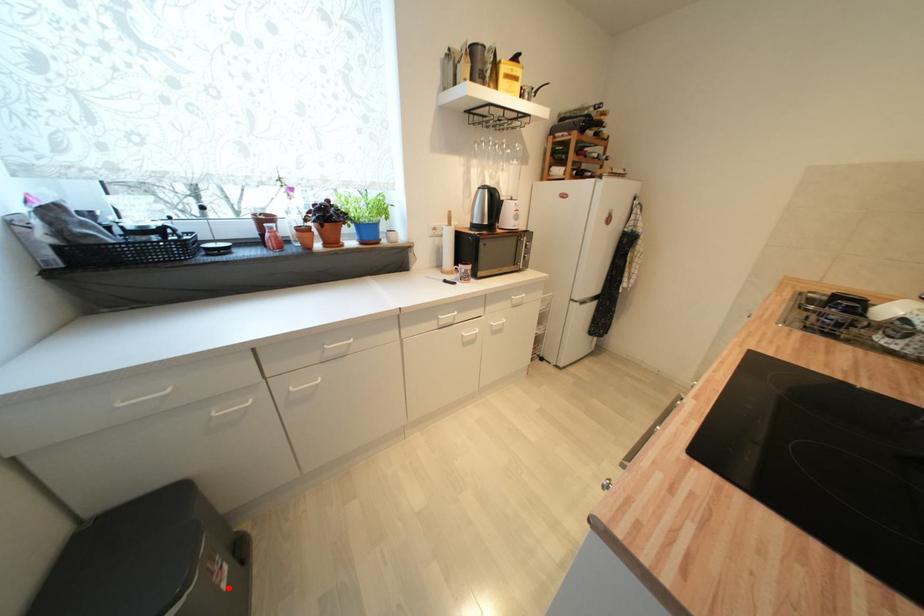
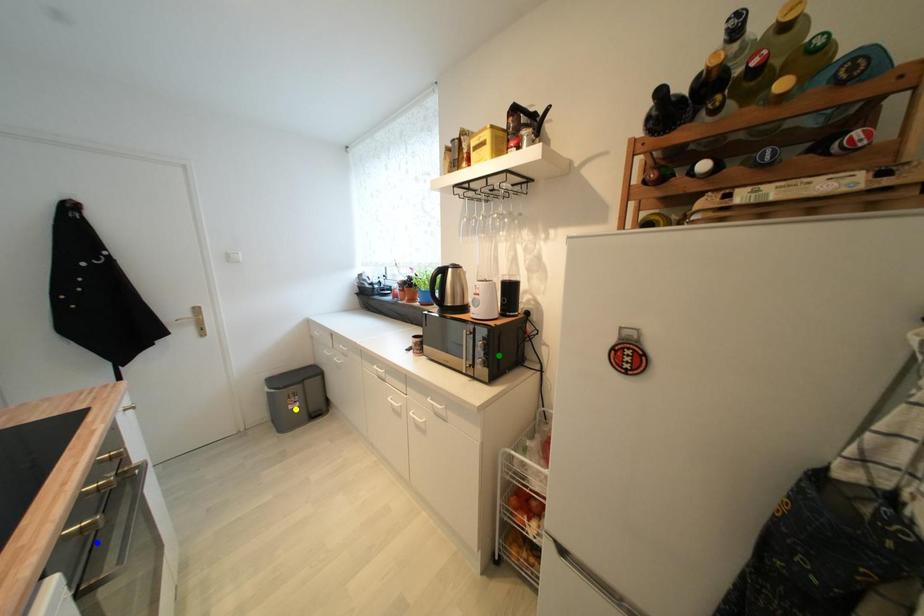
Question: I am providing you with two images of the same scene from different viewpoints. A red point is marked on the first image. You are given multiple points on the second image. Can you choose the point in image 2 that corresponds to the point in image 1?

Choices:
 (A) green point
 (B) blue point
 (C) yellow point

Answer: (C)